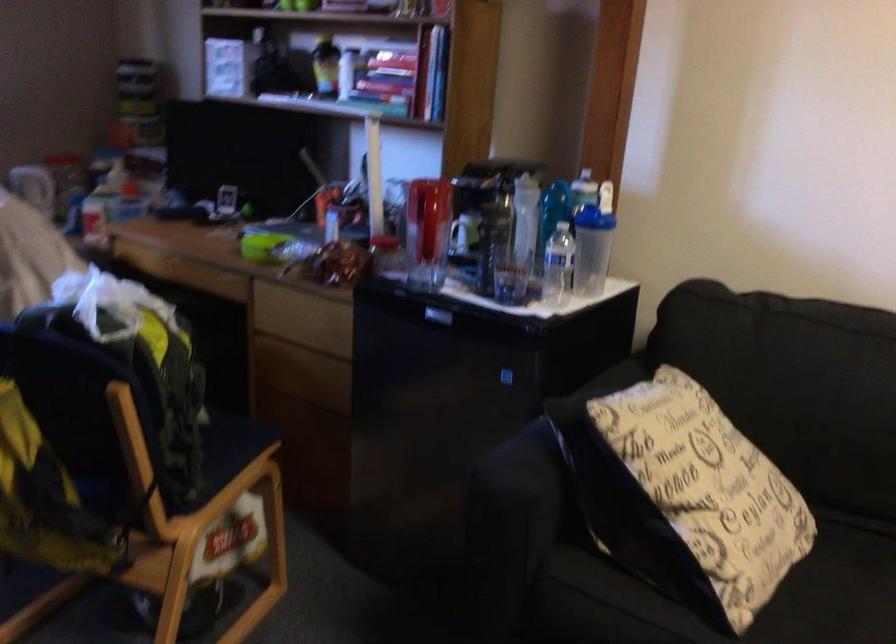
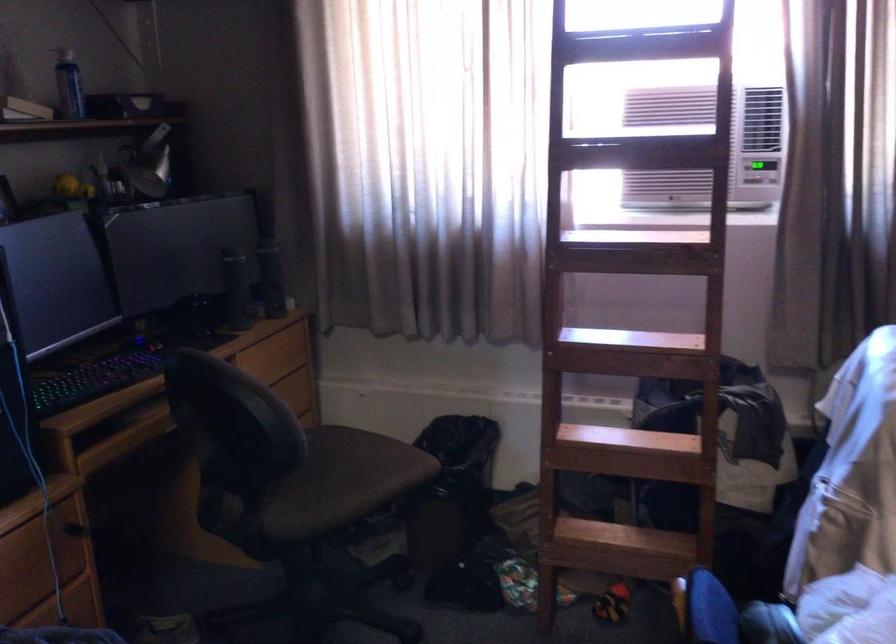
Question: The first image is from the beginning of the video and the second image is from the end. How did the camera likely rotate when shooting the video?

Choices:
 (A) Left
 (B) Right
 (C) Up
 (D) Down

Answer: (A)